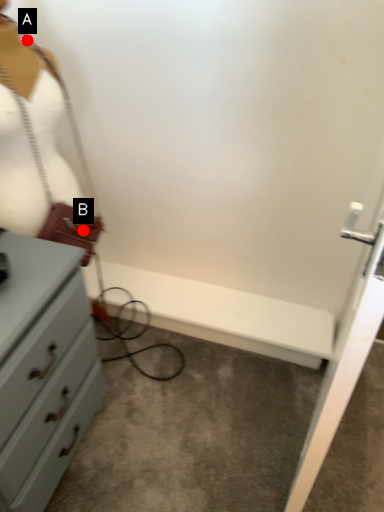
Question: Two points are circled on the image, labeled by A and B beside each circle. Which point is farther to the camera?

Choices:
 (A) A is further
 (B) B is further

Answer: (B)